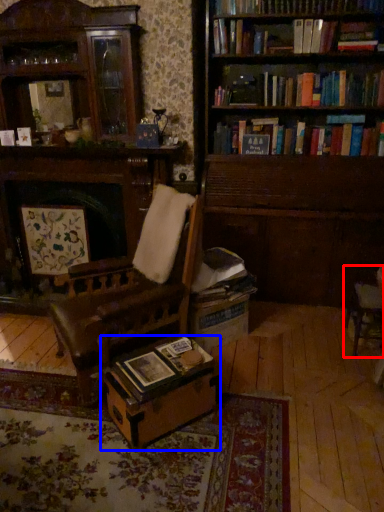
Question: Which object appears closest to the camera in this image, chair (highlighted by a red box) or table (highlighted by a blue box)?

Choices:
 (A) chair
 (B) table

Answer: (B)